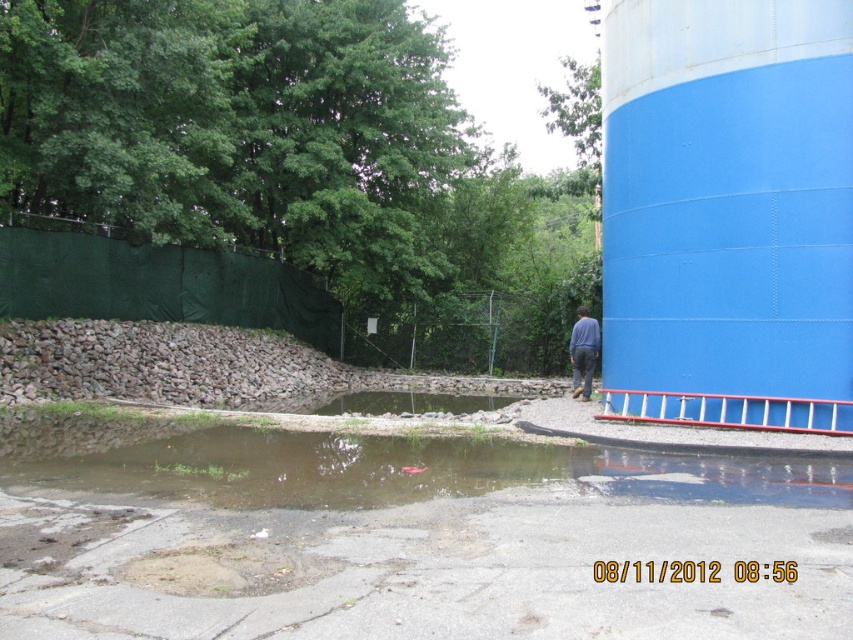
You are a maintenance worker needing to inspect the blue painted steel water tower at right and the brown concrete flood at lower center. Which object should you check first if you want to start from the lowest point in the scene?

The brown concrete flood at lower center should be checked first since it is located below the blue painted steel water tower at right, making it the lower point in the scene.

You are a maintenance worker who needs to inspect the blue painted steel water tower at right and the blue jeans at lower right. Which object is closer to you based on their sizes in the image?

The blue jeans at lower right are larger in the image, so they are closer to you than the blue painted steel water tower at right.

You are standing in the outdoor scene and see the blue painted steel water tower at right and the blue jeans at lower right. Which object is located to the right of the other?

The blue painted steel water tower at right is positioned on the right side of blue jeans at lower right, so the water tower is to the right of the blue jeans.